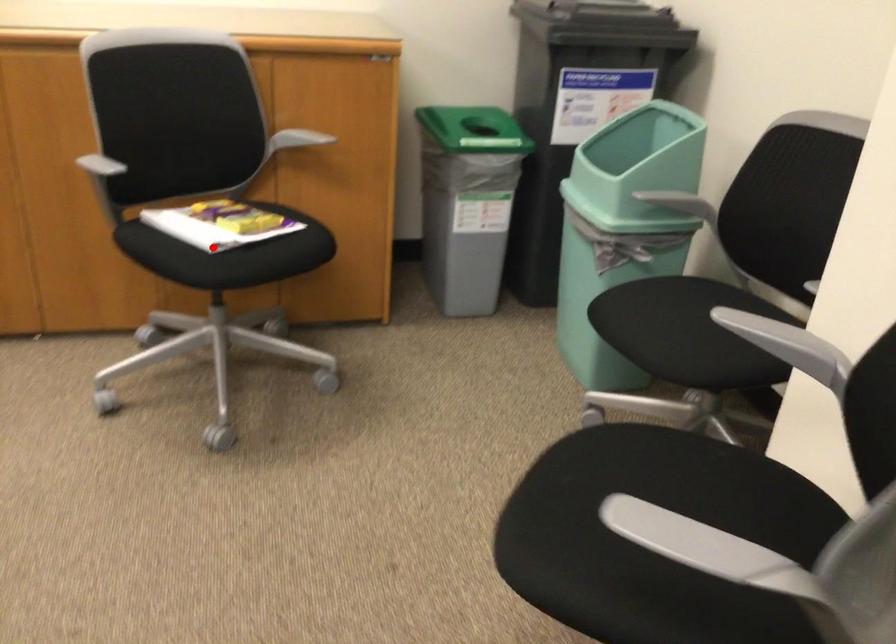
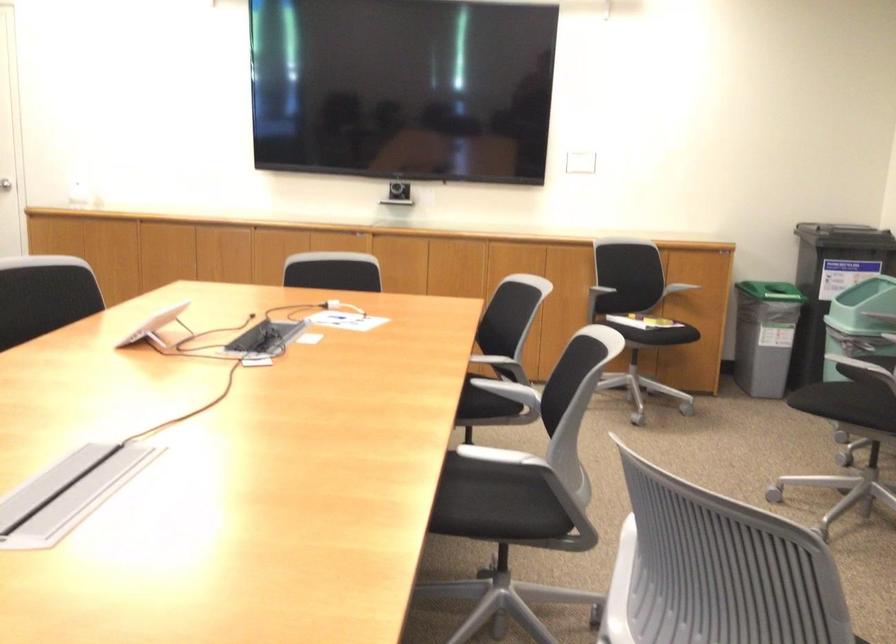
Question: I am providing you with two images of the same scene from different viewpoints. Given a red point in image1, look at the same physical point in image2. Is it:

Choices:
 (A) Closer to the viewpoint
 (B) Farther from the viewpoint

Answer: (B)